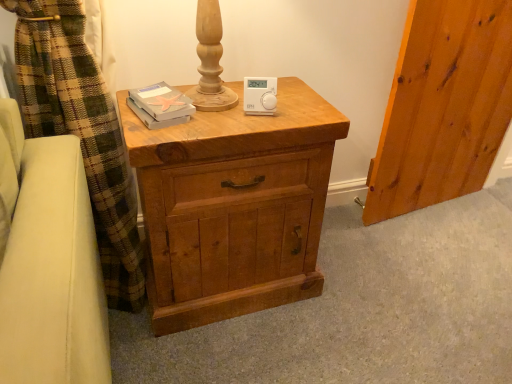
Identify the location of free location in front of matte gray book at upper left. (x=165, y=124).